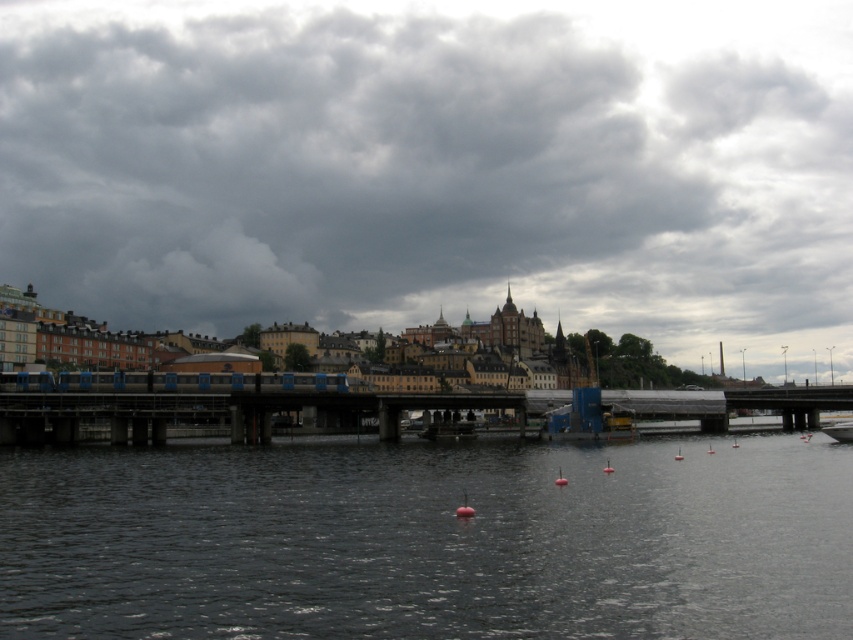
Question: Observing the image, what is the correct spatial positioning of metallic gray bridge at center in reference to white plastic boat at lower right?

Choices:
 (A) above
 (B) below

Answer: (A)

Question: Based on their relative distances, which object is farther from the white plastic boat at lower right?

Choices:
 (A) metallic gray bridge at center
 (B) dark gray cloud at upper center
 (C) dark water at center

Answer: (B)

Question: Can you confirm if dark gray cloud at upper center is positioned above metallic gray bridge at center?

Choices:
 (A) yes
 (B) no

Answer: (A)

Question: Which point is closer to the camera taking this photo?

Choices:
 (A) (56, 160)
 (B) (843, 428)

Answer: (B)

Question: Which of the following is the closest to the observer?

Choices:
 (A) (590, 616)
 (B) (833, 429)
 (C) (386, 188)
 (D) (138, 400)

Answer: (A)

Question: Is dark water at center in front of white plastic boat at lower right?

Choices:
 (A) yes
 (B) no

Answer: (A)